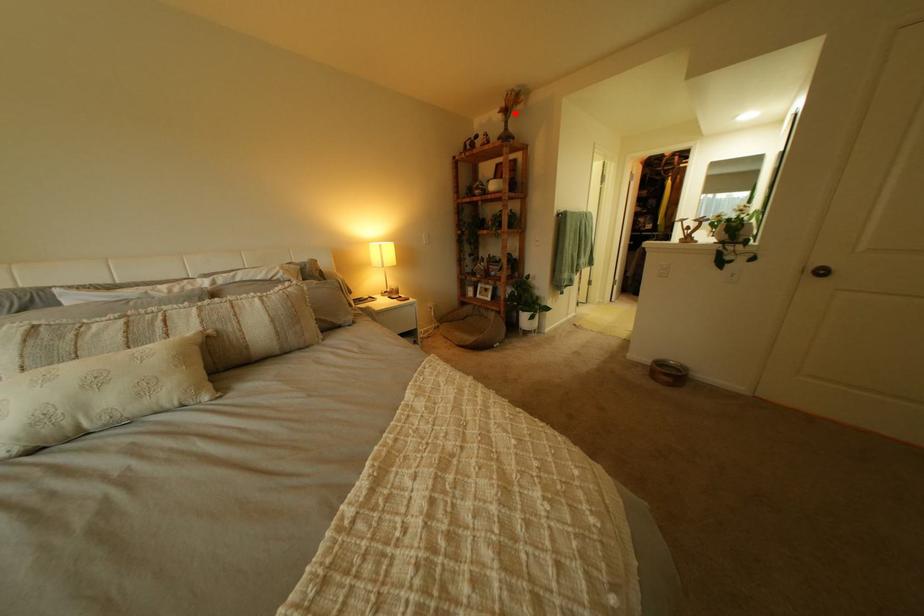
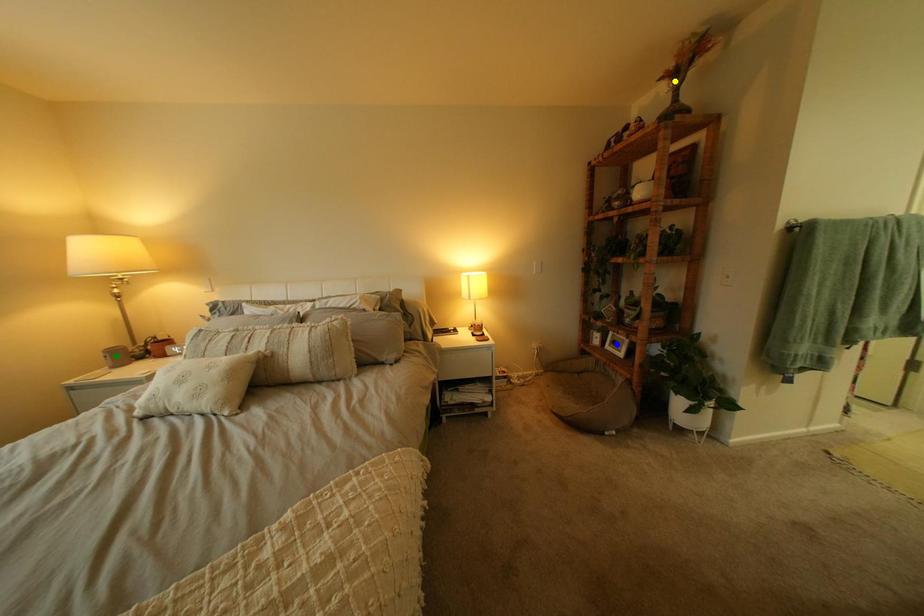
Question: I am providing you with two images of the same scene from different viewpoints. A red point is marked on the first image. You are given multiple points on the second image. In image 2, which mark is for the same physical point as the one in image 1?

Choices:
 (A) yellow point
 (B) blue point
 (C) green point

Answer: (A)